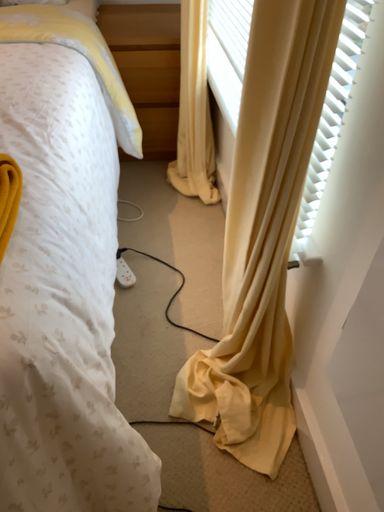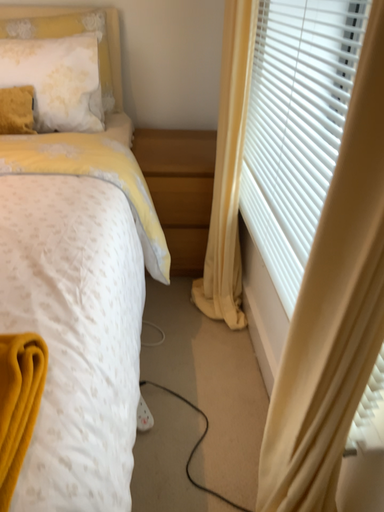
Question: How did the camera likely rotate when shooting the video?

Choices:
 (A) rotated upward
 (B) rotated downward

Answer: (A)